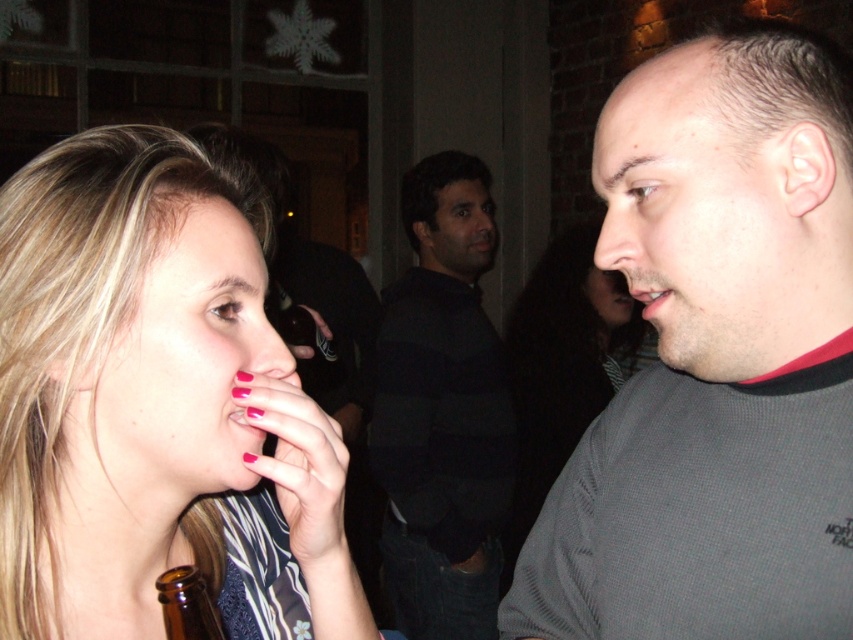
Is point (618, 228) closer to viewer compared to point (183, 577)?

That is False.

Does point (611, 216) lie behind point (201, 621)?

Yes, it is behind point (201, 621).

Who is more forward, (607,266) or (212,604)?

Positioned in front is point (212,604).

You are a GUI agent. You are given a task and a screenshot of the screen. Output one action in this format:
    pyautogui.click(x=<x>, y=<y>)
    Task: Click on the matte gray nose at center
    This screenshot has width=853, height=640.
    Given the screenshot: What is the action you would take?
    point(624,236)

Is matte pink nose at center shorter than pink matte nail polish at mouth right?

No, matte pink nose at center is not shorter than pink matte nail polish at mouth right.

Who is taller, matte pink nose at center or pink matte nail polish at mouth right?

With more height is matte pink nose at center.

Who is more forward, (285, 360) or (253, 410)?

Point (253, 410)

The width and height of the screenshot is (853, 640). Identify the location of matte pink nose at center. (282, 346).

Is dark blue sweater at center to the right of pink glossy lips at center from the viewer's perspective?

Incorrect, dark blue sweater at center is not on the right side of pink glossy lips at center.

Is dark blue sweater at center thinner than pink glossy lips at center?

Incorrect, dark blue sweater at center's width is not less than pink glossy lips at center's.

Which is behind, point (479, 406) or point (647, 316)?

Positioned behind is point (479, 406).

Identify the location of dark blue sweater at center. (440, 416).